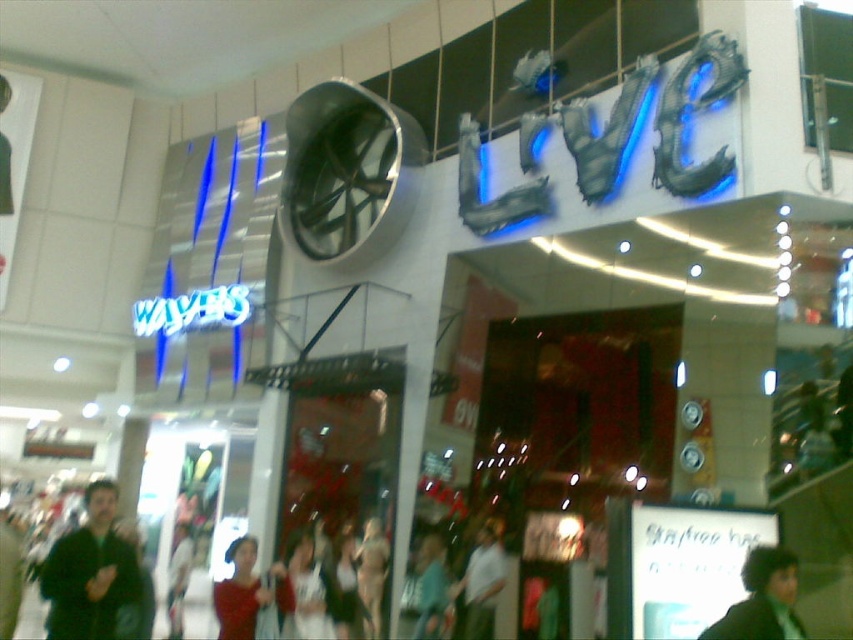
In the scene shown: You are a photographer trying to capture a candid shot of the dark brown hair at lower right and the white matte shirt at center. Which of the two subjects has a wider width?

The dark brown hair at lower right has a wider width than the white matte shirt at center.

You are a customer in the shopping area looking at the white fabric dress at center and the white matte shirt at center. Which item is closer to you?

The white fabric dress at center is closer to you because it is in front of the white matte shirt at center.

You are a photographer standing in the shopping area and want to take a picture of the dark brown hair at lower right and the matte red dress at center. Which object is positioned higher in the frame?

The dark brown hair at lower right is above the matte red dress at center, so it is positioned higher in the frame.